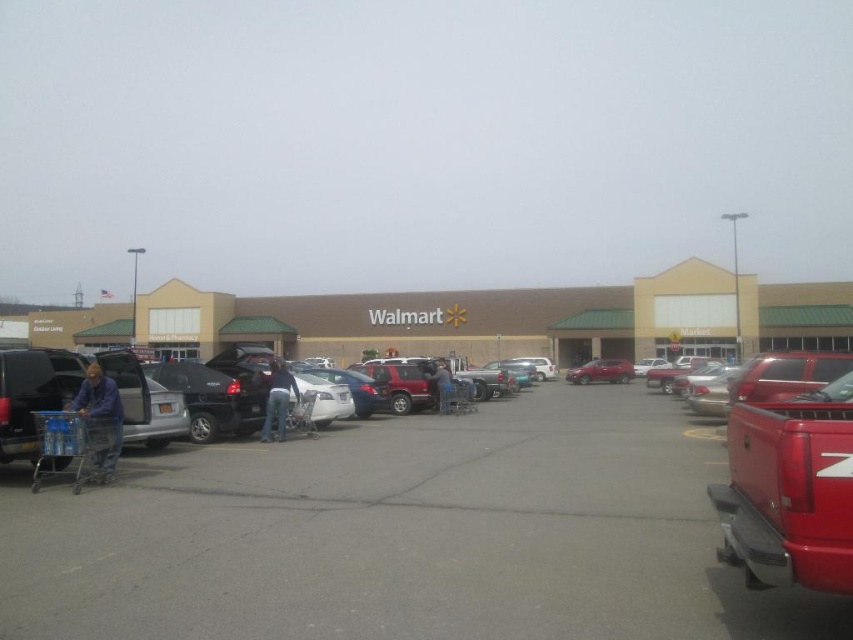
Question: Among these objects, which one is nearest to the camera?

Choices:
 (A) satin red sedan at center
 (B) denim jacket at center
 (C) blue denim jeans at lower left

Answer: (C)

Question: Which of the following is the farthest from the observer?

Choices:
 (A) metallic silver shopping cart at center
 (B) red matte truck at right

Answer: (A)

Question: Estimate the real-world distances between objects in this image. Which object is closer to the blue jeans at center?

Choices:
 (A) satin red sedan at center
 (B) denim jacket at center

Answer: (B)

Question: Can you confirm if metallic silver shopping cart at lower left is thinner than denim jacket at center?

Choices:
 (A) no
 (B) yes

Answer: (A)

Question: Can you confirm if beige/textured building at center is positioned above satin red sedan at center?

Choices:
 (A) yes
 (B) no

Answer: (A)

Question: Can you confirm if red matte truck at right is smaller than blue jeans at center?

Choices:
 (A) no
 (B) yes

Answer: (B)